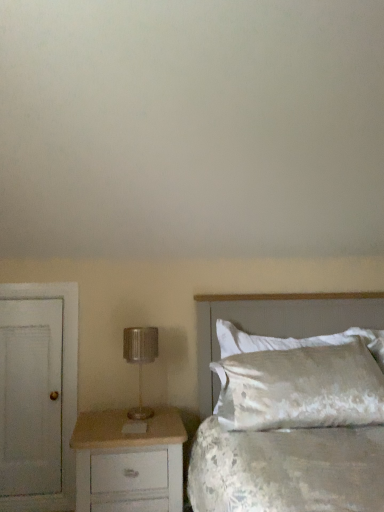
The height and width of the screenshot is (512, 384). Find the location of `free space above white painted wood chest of drawers at lower left (from a real-world perspective)`. free space above white painted wood chest of drawers at lower left (from a real-world perspective) is located at coordinates (139, 414).